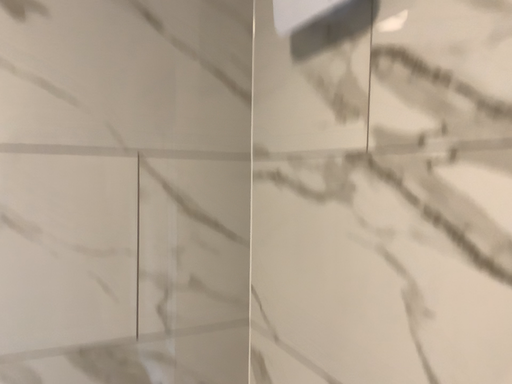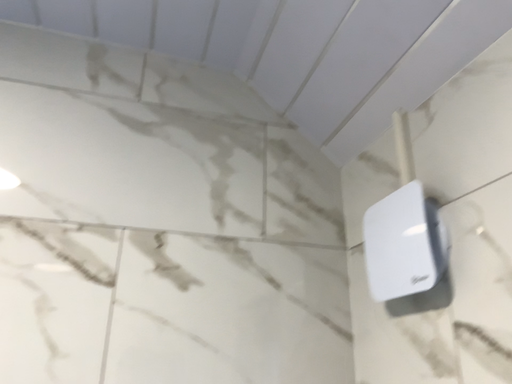
Question: How did the camera likely rotate when shooting the video?

Choices:
 (A) rotated left
 (B) rotated right

Answer: (A)